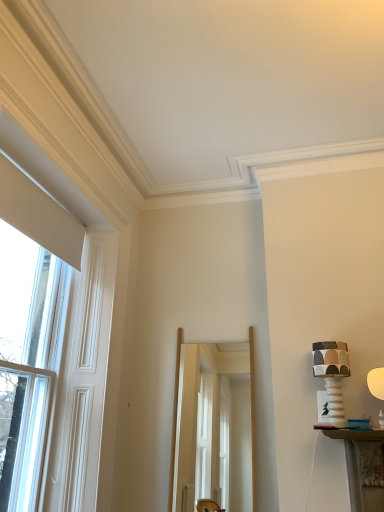
Identify the location of clear glass screen door at center. Image resolution: width=384 pixels, height=512 pixels. (197, 402).

Find the location of a particular element. The width and height of the screenshot is (384, 512). clear glass window at left is located at coordinates (30, 330).

You are a GUI agent. You are given a task and a screenshot of the screen. Output one action in this format:
    pyautogui.click(x=<x>, y=<y>)
    Task: Click on the clear glass screen door at center
    The height and width of the screenshot is (512, 384).
    Given the screenshot: What is the action you would take?
    (197, 402)

Is the depth of matte ceramic lampshade at right, positioned as the first table lamp in right-to-left order, greater than that of clear glass screen door at center?

No, it is not.

From the image's perspective, is matte ceramic lampshade at right, which ranks as the second table lamp in left-to-right order, located above clear glass screen door at center?

Yes.

Is matte ceramic lampshade at right, which ranks as the second table lamp in left-to-right order, spatially inside clear glass screen door at center, or outside of it?

matte ceramic lampshade at right, which ranks as the second table lamp in left-to-right order, lies outside clear glass screen door at center.

Which is more to the right, matte ceramic lampshade at right, which ranks as the second table lamp in left-to-right order, or clear glass screen door at center?

Positioned to the right is matte ceramic lampshade at right, which ranks as the second table lamp in left-to-right order.

Which object is more forward, matte ceramic lampshade at right, which ranks as the second table lamp in left-to-right order, or patterned fabric lampshade at right, arranged as the 1th table lamp when viewed from the left?

matte ceramic lampshade at right, which ranks as the second table lamp in left-to-right order.

From a real-world perspective, which is physically above, matte ceramic lampshade at right, positioned as the first table lamp in right-to-left order, or patterned fabric lampshade at right, arranged as the 1th table lamp when viewed from the left?

In real-world perspective, patterned fabric lampshade at right, arranged as the 1th table lamp when viewed from the left, is above.

Where is `table lamp above the matte ceramic lampshade at right, which ranks as the second table lamp in left-to-right order (from the image's perspective)`? The width and height of the screenshot is (384, 512). table lamp above the matte ceramic lampshade at right, which ranks as the second table lamp in left-to-right order (from the image's perspective) is located at coordinates (332, 375).

Would you say clear glass screen door at center is outside clear glass window at left?

clear glass screen door at center is positioned outside clear glass window at left.

Between clear glass screen door at center and clear glass window at left, which one appears on the right side from the viewer's perspective?

Positioned to the right is clear glass screen door at center.

In terms of size, does clear glass screen door at center appear bigger or smaller than clear glass window at left?

In the image, clear glass screen door at center appears to be smaller than clear glass window at left.

Is there a large distance between clear glass window at left and clear glass screen door at center?

Indeed, clear glass window at left is not near clear glass screen door at center.

In terms of width, does clear glass window at left look wider or thinner when compared to clear glass screen door at center?

Clearly, clear glass window at left has more width compared to clear glass screen door at center.

From the image's perspective, which object appears higher, clear glass window at left or clear glass screen door at center?

clear glass window at left is shown above in the image.

Between clear glass window at left and clear glass screen door at center, which one appears on the right side from the viewer's perspective?

clear glass screen door at center.

Is patterned fabric lampshade at right, arranged as the 1th table lamp when viewed from the left, not near matte ceramic lampshade at right, which ranks as the second table lamp in left-to-right order?

No.

Between patterned fabric lampshade at right, which appears as the 2th table lamp when viewed from the right, and matte ceramic lampshade at right, positioned as the first table lamp in right-to-left order, which one has less height?

Standing shorter between the two is matte ceramic lampshade at right, positioned as the first table lamp in right-to-left order.

At what (x,y) coordinates should I click in order to perform the action: click on table lamp in front of the patterned fabric lampshade at right, arranged as the 1th table lamp when viewed from the left. Please return your answer as a coordinate pair (x, y). This screenshot has width=384, height=512. Looking at the image, I should click on (376, 382).

Which object is positioned more to the right, clear glass screen door at center or matte ceramic lampshade at right, which ranks as the second table lamp in left-to-right order?

matte ceramic lampshade at right, which ranks as the second table lamp in left-to-right order.

Is point (190, 451) less distant than point (372, 389)?

No, it is behind (372, 389).

Who is bigger, clear glass screen door at center or matte ceramic lampshade at right, which ranks as the second table lamp in left-to-right order?

With larger size is clear glass screen door at center.

Image resolution: width=384 pixels, height=512 pixels. What are the coordinates of `the 2nd table lamp in front when counting from the clear glass screen door at center` in the screenshot? It's located at (376, 382).

Is point (332, 358) positioned behind point (45, 310)?

No, it is in front of (45, 310).

From a real-world perspective, who is located lower, patterned fabric lampshade at right, which appears as the 2th table lamp when viewed from the right, or clear glass window at left?

patterned fabric lampshade at right, which appears as the 2th table lamp when viewed from the right, is physically lower.

Locate an element on the screen. window on the left of patterned fabric lampshade at right, which appears as the 2th table lamp when viewed from the right is located at coordinates (30, 330).

At what (x,y) coordinates should I click in order to perform the action: click on screen door to the left of matte ceramic lampshade at right, which ranks as the second table lamp in left-to-right order. Please return your answer as a coordinate pair (x, y). Looking at the image, I should click on (197, 402).

The height and width of the screenshot is (512, 384). There is a matte ceramic lampshade at right, positioned as the first table lamp in right-to-left order. What are the coordinates of `table lamp above it (from a real-world perspective)` in the screenshot? It's located at (332, 375).

Considering their positions, is matte ceramic lampshade at right, positioned as the first table lamp in right-to-left order, positioned further to clear glass window at left than patterned fabric lampshade at right, arranged as the 1th table lamp when viewed from the left?

matte ceramic lampshade at right, positioned as the first table lamp in right-to-left order, lies further to clear glass window at left than the other object.

Estimate the real-world distances between objects in this image. Which object is further from matte ceramic lampshade at right, positioned as the first table lamp in right-to-left order, patterned fabric lampshade at right, arranged as the 1th table lamp when viewed from the left, or clear glass window at left?

clear glass window at left is further to matte ceramic lampshade at right, positioned as the first table lamp in right-to-left order.

From the picture: From the image, which object appears to be farther from patterned fabric lampshade at right, arranged as the 1th table lamp when viewed from the left, clear glass screen door at center or matte ceramic lampshade at right, positioned as the first table lamp in right-to-left order?

Based on the image, clear glass screen door at center appears to be further to patterned fabric lampshade at right, arranged as the 1th table lamp when viewed from the left.

Based on their spatial positions, is clear glass screen door at center or clear glass window at left further from matte ceramic lampshade at right, which ranks as the second table lamp in left-to-right order?

Among the two, clear glass window at left is located further to matte ceramic lampshade at right, which ranks as the second table lamp in left-to-right order.

When comparing their distances from clear glass window at left, does patterned fabric lampshade at right, which appears as the 2th table lamp when viewed from the right, or matte ceramic lampshade at right, positioned as the first table lamp in right-to-left order, seem further?

The object further to clear glass window at left is matte ceramic lampshade at right, positioned as the first table lamp in right-to-left order.

Which object lies further to the anchor point clear glass window at left, clear glass screen door at center or patterned fabric lampshade at right, which appears as the 2th table lamp when viewed from the right?

Based on the image, patterned fabric lampshade at right, which appears as the 2th table lamp when viewed from the right, appears to be further to clear glass window at left.

Based on their spatial positions, is patterned fabric lampshade at right, arranged as the 1th table lamp when viewed from the left, or clear glass screen door at center further from matte ceramic lampshade at right, which ranks as the second table lamp in left-to-right order?

Based on the image, clear glass screen door at center appears to be further to matte ceramic lampshade at right, which ranks as the second table lamp in left-to-right order.

From the image, which object appears to be nearer to clear glass screen door at center, clear glass window at left or patterned fabric lampshade at right, arranged as the 1th table lamp when viewed from the left?

The object closer to clear glass screen door at center is patterned fabric lampshade at right, arranged as the 1th table lamp when viewed from the left.

At what (x,y) coordinates should I click in order to perform the action: click on screen door situated between clear glass window at left and patterned fabric lampshade at right, which appears as the 2th table lamp when viewed from the right, from left to right. Please return your answer as a coordinate pair (x, y). The image size is (384, 512). Looking at the image, I should click on (197, 402).

Locate an element on the screen. screen door between clear glass window at left and matte ceramic lampshade at right, which ranks as the second table lamp in left-to-right order, from left to right is located at coordinates (197, 402).

This screenshot has height=512, width=384. I want to click on table lamp situated between clear glass window at left and matte ceramic lampshade at right, positioned as the first table lamp in right-to-left order, from left to right, so click(x=332, y=375).

This screenshot has width=384, height=512. What are the coordinates of `table lamp between clear glass screen door at center and matte ceramic lampshade at right, positioned as the first table lamp in right-to-left order` in the screenshot? It's located at (332, 375).